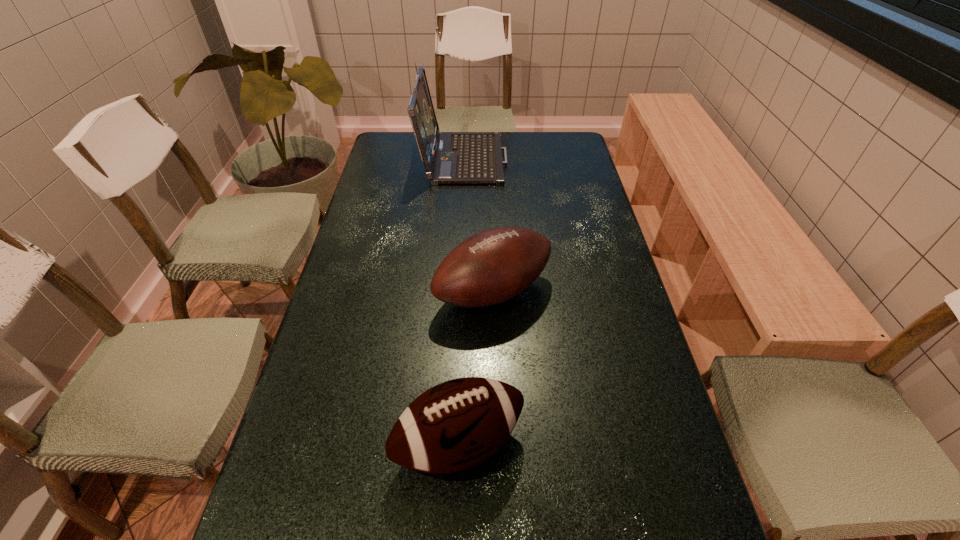
The width and height of the screenshot is (960, 540). I want to click on the tallest object, so click(x=449, y=158).

You are a GUI agent. You are given a task and a screenshot of the screen. Output one action in this format:
    pyautogui.click(x=<x>, y=<y>)
    Task: Click on the farthest object
    
    Given the screenshot: What is the action you would take?
    pyautogui.click(x=449, y=158)

Locate an element on the screen. The width and height of the screenshot is (960, 540). the farther football (American) is located at coordinates (495, 265).

I want to click on the nearer football (American), so click(458, 424).

Where is `vacant space located 0.230m on the front-facing side of the tallest object`? vacant space located 0.230m on the front-facing side of the tallest object is located at coordinates (566, 157).

Image resolution: width=960 pixels, height=540 pixels. Find the location of `free space located 0.230m on the back of the farther football (American)`. free space located 0.230m on the back of the farther football (American) is located at coordinates (491, 214).

Image resolution: width=960 pixels, height=540 pixels. I want to click on blank space located 0.080m on the right of the nearer football (American), so click(x=563, y=444).

The height and width of the screenshot is (540, 960). In order to click on object that is at the far edge in this screenshot , I will do `click(449, 158)`.

The image size is (960, 540). In the image, there is a desktop. In order to click on free region at the far edge in this screenshot , I will do `click(524, 136)`.

Locate an element on the screen. vacant space at the left edge of the desktop is located at coordinates (x=352, y=349).